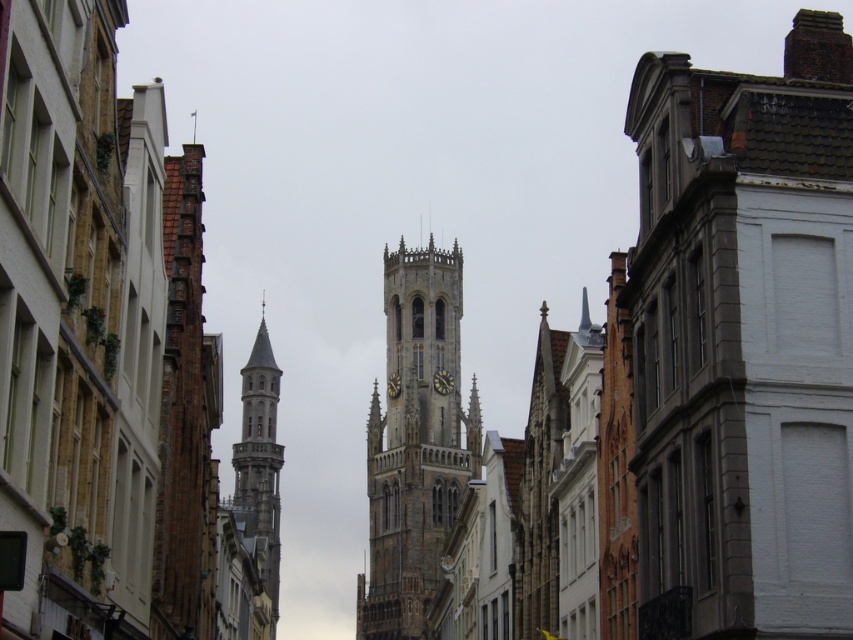
Question: Which object appears farthest from the camera in this image?

Choices:
 (A) stone clock tower at center
 (B) smooth stone tower at left
 (C) stone tower at center

Answer: (A)

Question: Which point is closer to the camera?

Choices:
 (A) (262, 404)
 (B) (115, 390)
 (C) (451, 353)

Answer: (B)

Question: Is the position of stone tower at center less distant than that of stone clock tower at center?

Choices:
 (A) no
 (B) yes

Answer: (B)

Question: Is stone tower at center below smooth stone tower at left?

Choices:
 (A) yes
 (B) no

Answer: (B)

Question: Which of the following is the farthest from the observer?

Choices:
 (A) (204, 349)
 (B) (368, 442)

Answer: (B)

Question: Considering the relative positions of stone tower at center and smooth stone tower at left in the image provided, where is stone tower at center located with respect to smooth stone tower at left?

Choices:
 (A) below
 (B) above

Answer: (B)